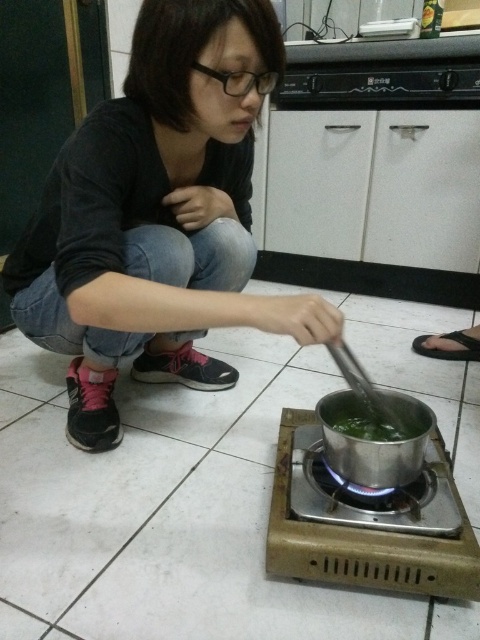
Question: From the image, what is the correct spatial relationship of silver metallic gas stove at center in relation to silver metallic gas stove at lower center?

Choices:
 (A) above
 (B) below

Answer: (B)

Question: Which point is closer to the camera?

Choices:
 (A) (358, 497)
 (B) (346, 420)
 (C) (442, 550)

Answer: (C)

Question: Estimate the real-world distances between objects in this image. Which object is farther from the matte black shirt at center?

Choices:
 (A) silver metallic gas stove at center
 (B) green matte pot at center
 (C) silver metallic gas stove at lower center

Answer: (C)

Question: Which of these objects is positioned closest to the silver metallic gas stove at lower center?

Choices:
 (A) matte black shirt at center
 (B) green matte pot at center

Answer: (B)

Question: Considering the relative positions of matte black shirt at center and silver metallic gas stove at lower center in the image provided, where is matte black shirt at center located with respect to silver metallic gas stove at lower center?

Choices:
 (A) above
 (B) below

Answer: (A)

Question: Can you confirm if silver metallic gas stove at lower center is bigger than green matte pot at center?

Choices:
 (A) yes
 (B) no

Answer: (A)